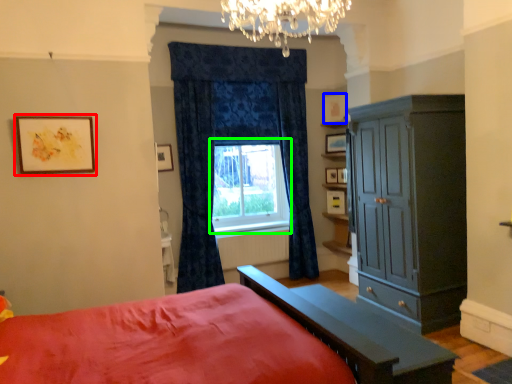
Question: Based on their relative distances, which object is nearer to picture frame (highlighted by a red box)? Choose from picture frame (highlighted by a blue box) and window (highlighted by a green box).

Choices:
 (A) picture frame
 (B) window

Answer: (B)